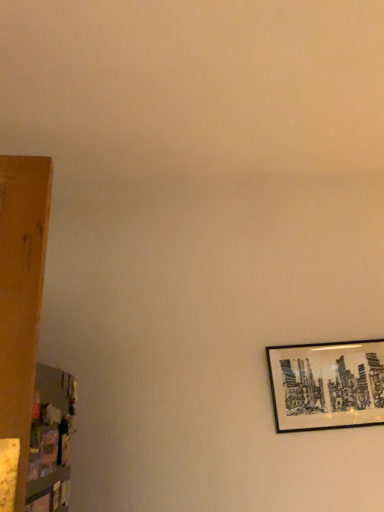
Question: Is black matte picture frame at right taller or shorter than wooden shelf at left?

Choices:
 (A) tall
 (B) short

Answer: (B)

Question: Visually, is black matte picture frame at right positioned to the left or to the right of wooden shelf at left?

Choices:
 (A) left
 (B) right

Answer: (B)

Question: From the image's perspective, relative to wooden shelf at left, is black matte picture frame at right above or below?

Choices:
 (A) below
 (B) above

Answer: (A)

Question: Considering the positions of wooden shelf at left and black matte picture frame at right in the image, is wooden shelf at left bigger or smaller than black matte picture frame at right?

Choices:
 (A) big
 (B) small

Answer: (B)

Question: From a real-world perspective, relative to black matte picture frame at right, is wooden shelf at left vertically above or below?

Choices:
 (A) below
 (B) above

Answer: (A)

Question: Considering the positions of point (43, 419) and point (274, 368), is point (43, 419) closer or farther from the camera than point (274, 368)?

Choices:
 (A) closer
 (B) farther

Answer: (A)

Question: Is wooden shelf at left to the left or to the right of black matte picture frame at right in the image?

Choices:
 (A) right
 (B) left

Answer: (B)